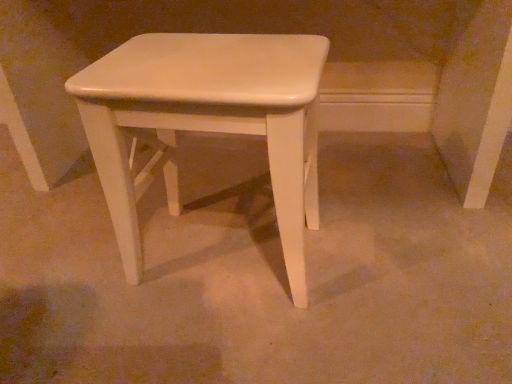
Question: Should I look upward or downward to see white glossy stool at center?

Choices:
 (A) up
 (B) down

Answer: (A)